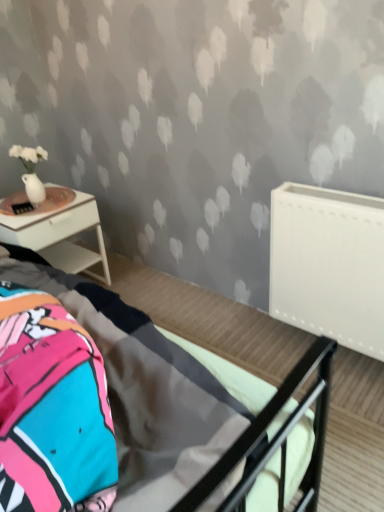
Locate an element on the screen. This screenshot has height=512, width=384. metallic gray bed at center is located at coordinates (188, 404).

What do you see at coordinates (60, 234) in the screenshot?
I see `white glossy nightstand at left` at bounding box center [60, 234].

Looking at this image, measure the distance between point (83,263) and camera.

Point (83,263) and camera are 2.34 meters apart.

The width and height of the screenshot is (384, 512). I want to click on metallic gray bed at center, so click(188, 404).

This screenshot has width=384, height=512. In order to click on nightstand that is behind the white matte radiator at right in this screenshot , I will do `click(60, 234)`.

Can you confirm if white glossy nightstand at left is smaller than white matte radiator at right?

No.

In the scene shown: From a real-world perspective, is white glossy nightstand at left located higher than white matte radiator at right?

No, from a real-world perspective, white glossy nightstand at left is not over white matte radiator at right

Is white glossy nightstand at left further to camera compared to white matte radiator at right?

That is True.

Which is more to the left, white glossy nightstand at left or metallic gray bed at center?

white glossy nightstand at left is more to the left.

Based on the photo, how different are the orientations of white glossy nightstand at left and metallic gray bed at center in degrees?

The facing directions of white glossy nightstand at left and metallic gray bed at center are 0.549 degrees apart.

From their relative heights in the image, would you say white glossy nightstand at left is taller or shorter than metallic gray bed at center?

In the image, white glossy nightstand at left appears to be shorter than metallic gray bed at center.

From a real-world perspective, is white matte radiator at right positioned above or below white glossy nightstand at left?

white matte radiator at right is situated higher than white glossy nightstand at left in the real world.

How far apart are white matte radiator at right and white glossy nightstand at left?

They are 3.71 feet apart.

Is white matte radiator at right to the left or to the right of white glossy nightstand at left in the image?

From the image, it's evident that white matte radiator at right is to the right of white glossy nightstand at left.

Is white matte radiator at right positioned with its back to white glossy nightstand at left?

No, white glossy nightstand at left is not at the back of white matte radiator at right.

In the image, is metallic gray bed at center positioned in front of or behind white glossy nightstand at left?

metallic gray bed at center is positioned closer to the viewer than white glossy nightstand at left.

Is white glossy nightstand at left located within metallic gray bed at center?

No, metallic gray bed at center does not contain white glossy nightstand at left.

Is metallic gray bed at center positioned with its back to white glossy nightstand at left?

No, metallic gray bed at center is not facing away from white glossy nightstand at left.

Which of these two, metallic gray bed at center or white glossy nightstand at left, stands shorter?

white glossy nightstand at left is shorter.

Which object is further away from the camera, white matte radiator at right or metallic gray bed at center?

white matte radiator at right is further from the camera.

From the image's perspective, would you say white matte radiator at right is positioned over metallic gray bed at center?

Yes.

Would you consider white matte radiator at right to be distant from metallic gray bed at center?

No, white matte radiator at right is in close proximity to metallic gray bed at center.

Does metallic gray bed at center lie in front of white matte radiator at right?

That is True.

Is metallic gray bed at center taller than white matte radiator at right?

Yes, metallic gray bed at center is taller than white matte radiator at right.

Is metallic gray bed at center inside the boundaries of white matte radiator at right, or outside?

The correct answer is: outside.

Find the location of a particular element. The image size is (384, 512). bed on the left of the white matte radiator at right is located at coordinates (188, 404).

Where is `radiator located below the white glossy nightstand at left (from the image's perspective)`? The image size is (384, 512). radiator located below the white glossy nightstand at left (from the image's perspective) is located at coordinates (328, 264).

At what (x,y) coordinates should I click in order to perform the action: click on bed lying in front of the white glossy nightstand at left. Please return your answer as a coordinate pair (x, y). The height and width of the screenshot is (512, 384). Looking at the image, I should click on (188, 404).

Which object lies nearer to the anchor point metallic gray bed at center, white glossy nightstand at left or white matte radiator at right?

Based on the image, white matte radiator at right appears to be nearer to metallic gray bed at center.

Based on their spatial positions, is metallic gray bed at center or white glossy nightstand at left further from white matte radiator at right?

Among the two, white glossy nightstand at left is located further to white matte radiator at right.

Looking at the image, which one is located closer to metallic gray bed at center, white matte radiator at right or white glossy nightstand at left?

white matte radiator at right lies closer to metallic gray bed at center than the other object.

Based on their spatial positions, is metallic gray bed at center or white matte radiator at right further from white glossy nightstand at left?

white matte radiator at right is further to white glossy nightstand at left.

When comparing their distances from white matte radiator at right, does white glossy nightstand at left or metallic gray bed at center seem further?

white glossy nightstand at left lies further to white matte radiator at right than the other object.

Which object lies further to the anchor point white glossy nightstand at left, white matte radiator at right or metallic gray bed at center?

Among the two, white matte radiator at right is located further to white glossy nightstand at left.

Identify the location of radiator positioned between metallic gray bed at center and white glossy nightstand at left from near to far. (328, 264).